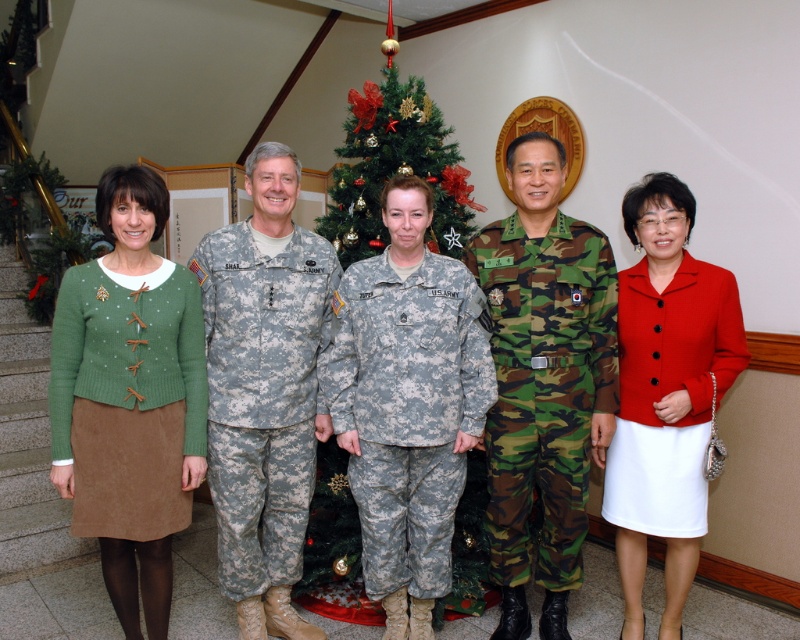
Question: Is matte red blazer at right above green textured sweater at left?

Choices:
 (A) no
 (B) yes

Answer: (A)

Question: Based on their relative distances, which object is farther from the camouflage fabric uniform at center?

Choices:
 (A) green suede skirt at left
 (B) camouflage uniform at center
 (C) camo uniform at center
 (D) green artificial christmas tree at center

Answer: (D)

Question: Does green suede skirt at left appear over green textured sweater at left?

Choices:
 (A) no
 (B) yes

Answer: (B)

Question: Is camouflage uniform at center behind camouflage fabric uniform at center?

Choices:
 (A) yes
 (B) no

Answer: (A)

Question: Which object is closer to the camera taking this photo?

Choices:
 (A) green artificial christmas tree at center
 (B) camouflage fabric uniform at center
 (C) green suede skirt at left
 (D) matte red blazer at right

Answer: (C)

Question: Which point is closer to the camera taking this photo?

Choices:
 (A) (66, 397)
 (B) (354, 440)
 (C) (442, 154)

Answer: (A)